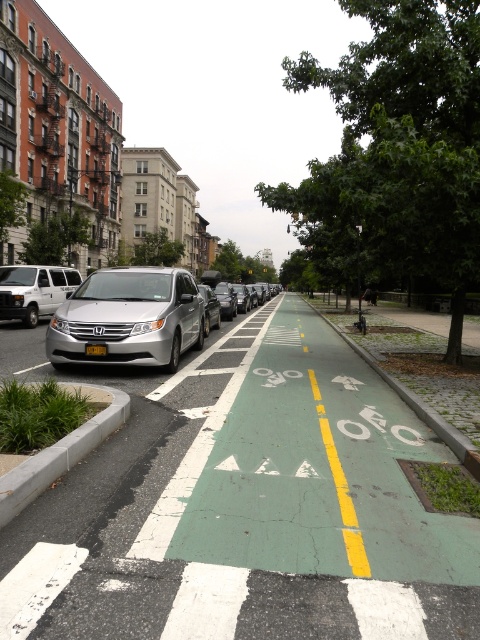
You are standing at the center of the image and want to walk to the gray concrete curb at lower left. In which general direction should you move?

You should move towards the lower left direction to reach the gray concrete curb at lower left.

You are standing at the point with coordinates (248, 508) in the image. What object are you standing on?

You are standing on the green painted bike lane at center.

You are a cyclist approaching an intersection and need to determine if your bike will fit within the green painted bike lane at center. Your bike has a width of 2.5 feet. Can you safely ride through the bike lane?

The green painted bike lane at center is 9.16 feet away from the camera, but this distance does not indicate the width of the bike lane. Therefore, it is unclear if your bike will fit safely.